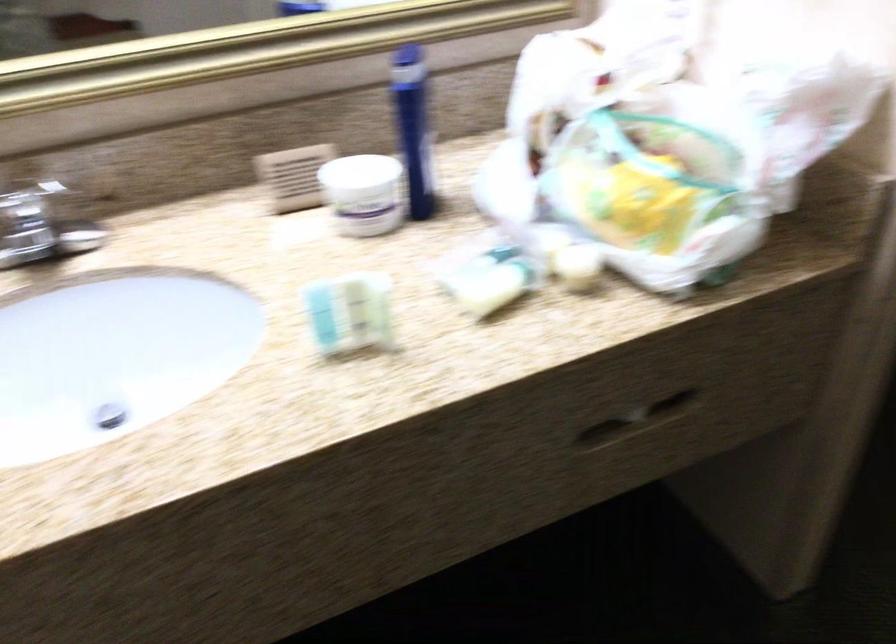
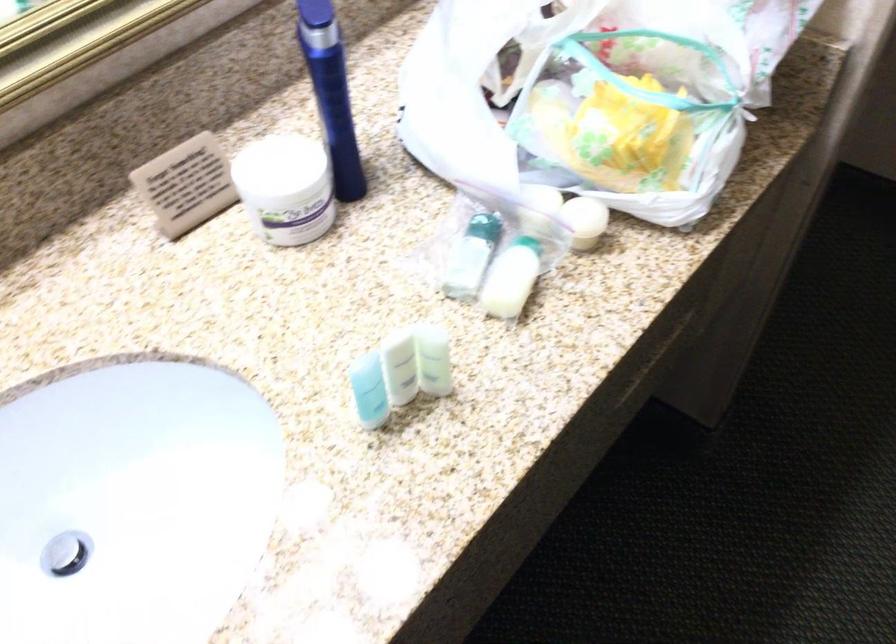
Where in the second image is the point corresponding to (105,413) from the first image?

(65, 554)